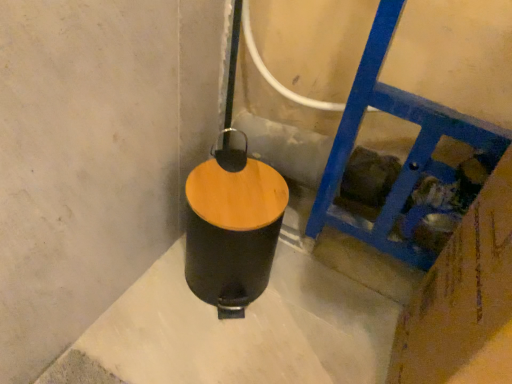
Question: Can you confirm if blue painted wood at right is smaller than black matte waste container at center?

Choices:
 (A) no
 (B) yes

Answer: (A)

Question: Is blue painted wood at right aimed at black matte waste container at center?

Choices:
 (A) yes
 (B) no

Answer: (B)

Question: Is black matte waste container at center a part of blue painted wood at right?

Choices:
 (A) yes
 (B) no

Answer: (B)

Question: Can you confirm if blue painted wood at right is wider than black matte waste container at center?

Choices:
 (A) no
 (B) yes

Answer: (B)

Question: Is blue painted wood at right further to the viewer compared to black matte waste container at center?

Choices:
 (A) no
 (B) yes

Answer: (A)

Question: Is blue painted wood at right looking in the opposite direction of black matte waste container at center?

Choices:
 (A) no
 (B) yes

Answer: (A)

Question: Could you tell me if black matte waste container at center is facing blue painted wood at right?

Choices:
 (A) yes
 (B) no

Answer: (B)

Question: Does black matte waste container at center have a larger size compared to blue painted wood at right?

Choices:
 (A) no
 (B) yes

Answer: (A)

Question: Is black matte waste container at center located outside blue painted wood at right?

Choices:
 (A) no
 (B) yes

Answer: (B)

Question: Does black matte waste container at center have a lesser height compared to blue painted wood at right?

Choices:
 (A) no
 (B) yes

Answer: (B)

Question: Are black matte waste container at center and blue painted wood at right making contact?

Choices:
 (A) yes
 (B) no

Answer: (B)

Question: Can you confirm if black matte waste container at center is positioned to the left of blue painted wood at right?

Choices:
 (A) yes
 (B) no

Answer: (A)

Question: Is blue painted wood at right inside or outside of black matte waste container at center?

Choices:
 (A) outside
 (B) inside

Answer: (A)